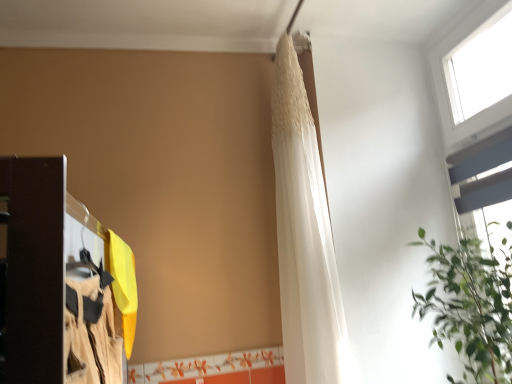
The height and width of the screenshot is (384, 512). Identify the location of green leafy plant at upper right. (470, 307).

This screenshot has width=512, height=384. What do you see at coordinates (470, 307) in the screenshot?
I see `green leafy plant at upper right` at bounding box center [470, 307].

The width and height of the screenshot is (512, 384). Identify the location of white plastic window at upper right. (453, 86).

This screenshot has height=384, width=512. Identify the location of green leafy plant at upper right. (470, 307).

In the scene shown: In terms of width, does white sheer fabric at upper center look wider or thinner when compared to white plastic window at upper right?

In the image, white sheer fabric at upper center appears to be wider than white plastic window at upper right.

Considering the relative positions of white sheer fabric at upper center and white plastic window at upper right in the image provided, is white sheer fabric at upper center to the left of white plastic window at upper right from the viewer's perspective?

Yes, white sheer fabric at upper center is to the left of white plastic window at upper right.

Find the location of a particular element. The height and width of the screenshot is (384, 512). window in front of the white sheer fabric at upper center is located at coordinates (453, 86).

Is point (334, 364) closer or farther from the camera than point (471, 136)?

Point (334, 364) appears to be closer to the viewer than point (471, 136).

Is green leafy plant at upper right positioned far away from white plastic window at upper right?

No, green leafy plant at upper right is not far from white plastic window at upper right.

Could you tell me if green leafy plant at upper right is facing white plastic window at upper right?

No, green leafy plant at upper right is not oriented towards white plastic window at upper right.

From a real-world perspective, is green leafy plant at upper right physically above white plastic window at upper right?

No, from a real-world perspective, green leafy plant at upper right is not over white plastic window at upper right

Is green leafy plant at upper right wider or thinner than white plastic window at upper right?

Considering their sizes, green leafy plant at upper right looks broader than white plastic window at upper right.

Considering the positions of point (504, 4) and point (471, 293), is point (504, 4) closer or farther from the camera than point (471, 293)?

Clearly, point (504, 4) is more distant from the camera than point (471, 293).

From a real-world perspective, who is located lower, white plastic window at upper right or green leafy plant at upper right?

green leafy plant at upper right.

Which of these two, white plastic window at upper right or green leafy plant at upper right, stands taller?

With more height is white plastic window at upper right.

Is white plastic window at upper right looking in the opposite direction of green leafy plant at upper right?

No, white plastic window at upper right's orientation is not away from green leafy plant at upper right.

The image size is (512, 384). I want to click on window that appears above the white sheer fabric at upper center (from a real-world perspective), so click(x=453, y=86).

Is white plastic window at upper right facing towards white sheer fabric at upper center?

Yes, white plastic window at upper right faces towards white sheer fabric at upper center.

Considering the positions of points (438, 66) and (294, 355), is point (438, 66) farther from camera compared to point (294, 355)?

Yes, it is behind point (294, 355).

Is the depth of white plastic window at upper right greater than that of white sheer fabric at upper center?

No.

Find the location of a particular element. shower curtain above the green leafy plant at upper right (from a real-world perspective) is located at coordinates (304, 237).

Is the depth of green leafy plant at upper right less than that of white sheer fabric at upper center?

Yes, the depth of green leafy plant at upper right is less than that of white sheer fabric at upper center.

Measure the distance between green leafy plant at upper right and white sheer fabric at upper center.

The distance of green leafy plant at upper right from white sheer fabric at upper center is 21.35 inches.

Considering the sizes of objects green leafy plant at upper right and white sheer fabric at upper center in the image provided, who is smaller, green leafy plant at upper right or white sheer fabric at upper center?

With smaller size is white sheer fabric at upper center.

Is white sheer fabric at upper center outside of green leafy plant at upper right?

white sheer fabric at upper center is positioned outside green leafy plant at upper right.

Does white sheer fabric at upper center turn towards green leafy plant at upper right?

No, white sheer fabric at upper center is not turned towards green leafy plant at upper right.

Locate an element on the screen. window that appears in front of the white sheer fabric at upper center is located at coordinates (453, 86).

Image resolution: width=512 pixels, height=384 pixels. Find the location of `window lying above the green leafy plant at upper right (from the image's perspective)`. window lying above the green leafy plant at upper right (from the image's perspective) is located at coordinates [x=453, y=86].

From the image, which object appears to be farther from white plastic window at upper right, white sheer fabric at upper center or green leafy plant at upper right?

white sheer fabric at upper center.

Considering their positions, is white plastic window at upper right positioned further to green leafy plant at upper right than white sheer fabric at upper center?

white plastic window at upper right.

Considering their positions, is white plastic window at upper right positioned further to white sheer fabric at upper center than green leafy plant at upper right?

Among the two, white plastic window at upper right is located further to white sheer fabric at upper center.

From the image, which object appears to be farther from green leafy plant at upper right, white sheer fabric at upper center or white plastic window at upper right?

white plastic window at upper right lies further to green leafy plant at upper right than the other object.

From the image, which object appears to be nearer to white plastic window at upper right, green leafy plant at upper right or white sheer fabric at upper center?

Based on the image, green leafy plant at upper right appears to be nearer to white plastic window at upper right.

Based on their spatial positions, is green leafy plant at upper right or white plastic window at upper right closer to white sheer fabric at upper center?

green leafy plant at upper right is positioned closer to the anchor white sheer fabric at upper center.

This screenshot has width=512, height=384. Identify the location of window between green leafy plant at upper right and white sheer fabric at upper center from front to back. (453, 86).